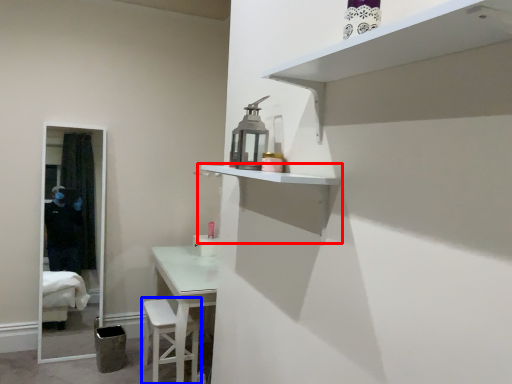
Question: Which object is closer to the camera taking this photo, shelf (highlighted by a red box) or step stool (highlighted by a blue box)?

Choices:
 (A) shelf
 (B) step stool

Answer: (A)